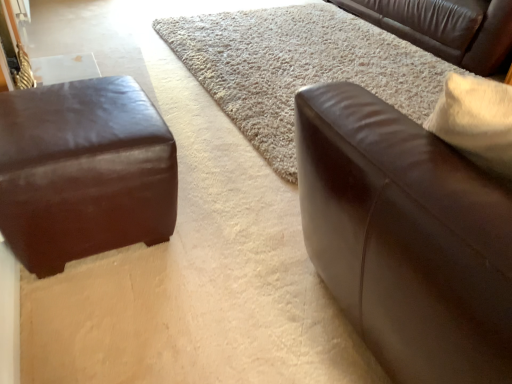
Question: Is brown leather couch at upper right, acting as the third studio couch starting from the front, in front of or behind beige shag rug at center in the image?

Choices:
 (A) behind
 (B) front

Answer: (A)

Question: Considering the positions of brown leather couch at upper right, acting as the 1th studio couch starting from the back, and beige shag rug at center in the image, is brown leather couch at upper right, acting as the 1th studio couch starting from the back, taller or shorter than beige shag rug at center?

Choices:
 (A) tall
 (B) short

Answer: (A)

Question: Based on their relative distances, which object is nearer to the matte brown leather ottoman at left, which appears as the third studio couch when viewed from the right?

Choices:
 (A) brown leather couch at right, which ranks as the 1th studio couch in front-to-back order
 (B) beige shag rug at center
 (C) brown leather couch at upper right, acting as the third studio couch starting from the front

Answer: (A)

Question: Which object is positioned farthest from the brown leather couch at right, which ranks as the third studio couch in back-to-front order?

Choices:
 (A) matte brown leather ottoman at left, which appears as the second studio couch when viewed from the front
 (B) brown leather couch at upper right, acting as the third studio couch starting from the front
 (C) beige shag rug at center

Answer: (B)